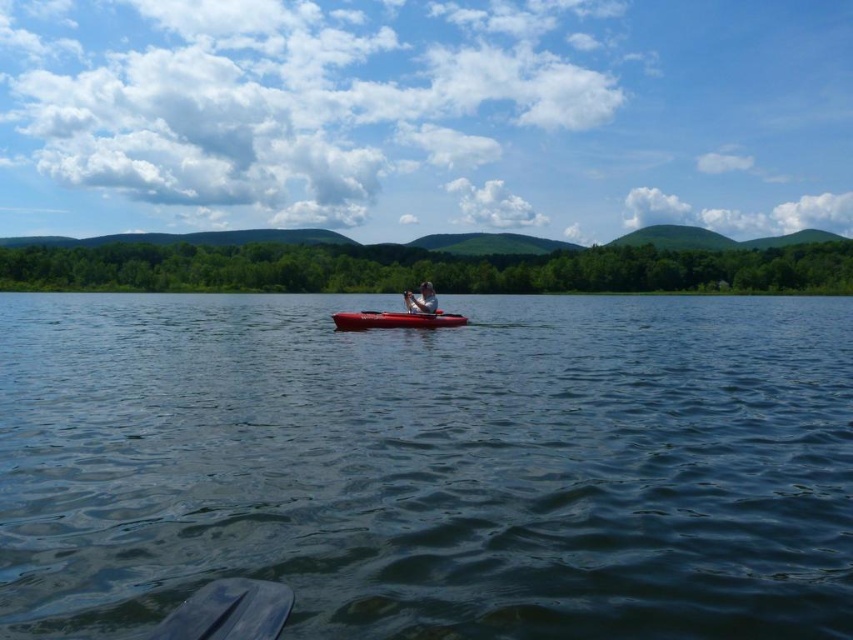
How distant is dark blue water at center from black plastic paddle at center?

A distance of 10.79 meters exists between dark blue water at center and black plastic paddle at center.

Is dark blue water at center bigger than black plastic paddle at center?

Indeed, dark blue water at center has a larger size compared to black plastic paddle at center.

This screenshot has height=640, width=853. Describe the element at coordinates (430, 465) in the screenshot. I see `dark blue water at center` at that location.

The width and height of the screenshot is (853, 640). Identify the location of dark blue water at center. (430, 465).

Between matte red canoe at center and matte gray kayak at center, which one appears on the left side from the viewer's perspective?

Positioned to the left is matte red canoe at center.

From the picture: Does matte red canoe at center have a larger size compared to matte gray kayak at center?

No.

Is point (381, 323) positioned after point (415, 298)?

No, it is not.

Locate an element on the screen. The image size is (853, 640). matte red canoe at center is located at coordinates (395, 320).

How far apart are dark blue water at center and matte gray kayak at center?

7.40 meters

Is dark blue water at center smaller than matte gray kayak at center?

No.

Measure the distance between point (413, 560) and camera.

Point (413, 560) and camera are 5.38 meters apart.

This screenshot has width=853, height=640. I want to click on dark blue water at center, so click(x=430, y=465).